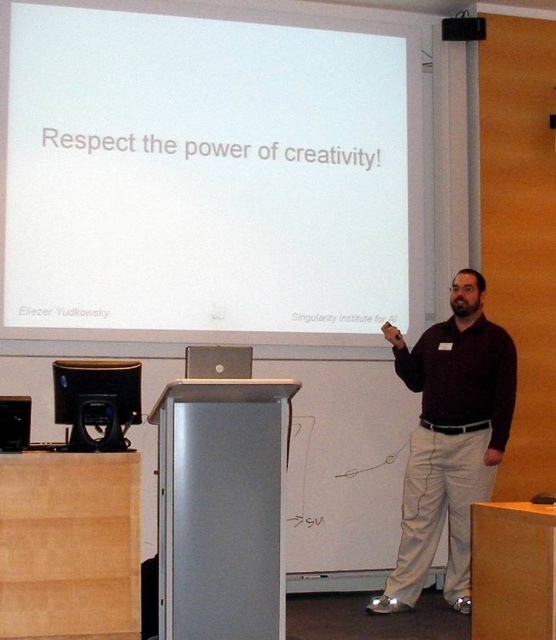
Based on the photo, you are setting up for a presentation and need to place a 1.2 meter tall stand next to the white matte projection screen at upper center and the matte black laptop at center. Based on their heights, will the stand fit between them vertically?

The white matte projection screen at upper center has a greater height compared to the matte black laptop at center. Since the stand is 1.2 meters tall, it can fit between them vertically as long as there is enough space between the two objects. However, the exact vertical clearance depends on their specific positions and the available space between them.

You are an attendee sitting in the front row of the conference room. You need to hand a document to the presenter who is standing near the whiteboard. The document is on your table, which is located between the dark brown sweater at center and the matte black laptop at center. Can you reach the document without moving from your seat?

The dark brown sweater at center is 8.20 feet away from the matte black laptop at center. Since the distance between them is quite large, you might not be able to reach the document on the table between them without moving from your seat.